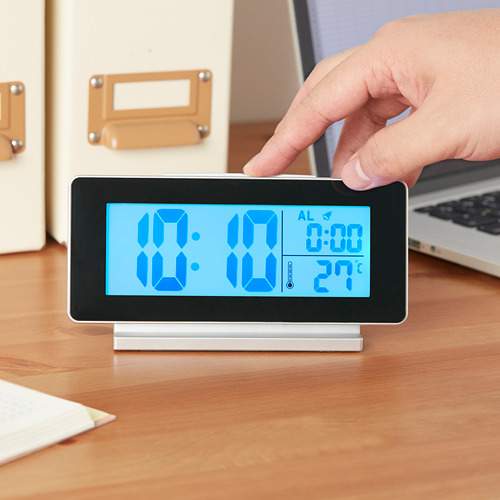
At what (x,y) coordinates should I click in order to perform the action: click on table. Please return your answer as a coordinate pair (x, y). The image size is (500, 500). Looking at the image, I should click on (270, 435).